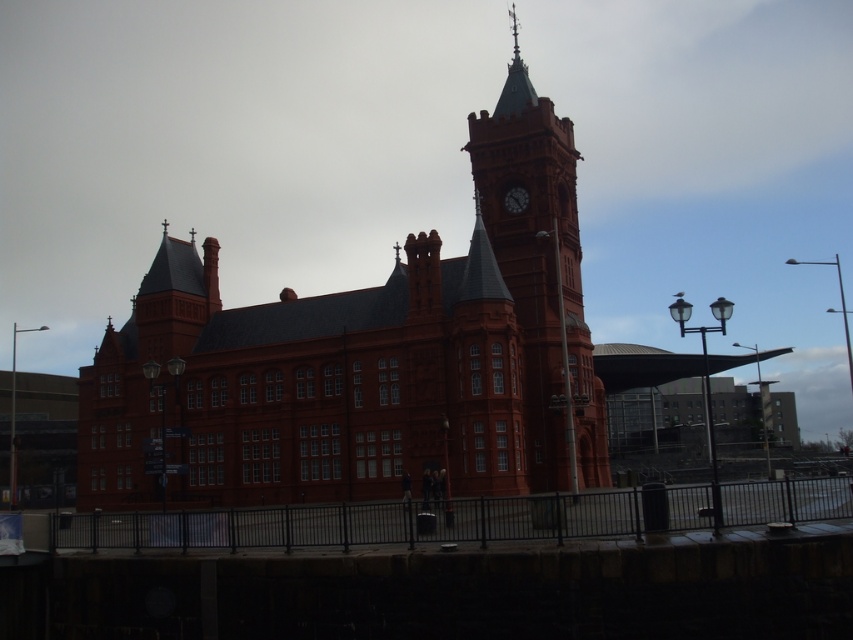
Question: In this image, where is matte brick clock tower at center located relative to dark brown wooden clock at upper center?

Choices:
 (A) above
 (B) below

Answer: (B)

Question: Which point appears farthest from the camera in this image?

Choices:
 (A) (465, 148)
 (B) (525, 192)

Answer: (A)

Question: Among these points, which one is farthest from the camera?

Choices:
 (A) (514, 204)
 (B) (546, 292)

Answer: (A)

Question: From the image, what is the correct spatial relationship of matte brick clock tower at center in relation to dark brown wooden clock at upper center?

Choices:
 (A) left
 (B) right

Answer: (B)

Question: Is matte brick clock tower at center wider than dark brown wooden clock at upper center?

Choices:
 (A) no
 (B) yes

Answer: (B)